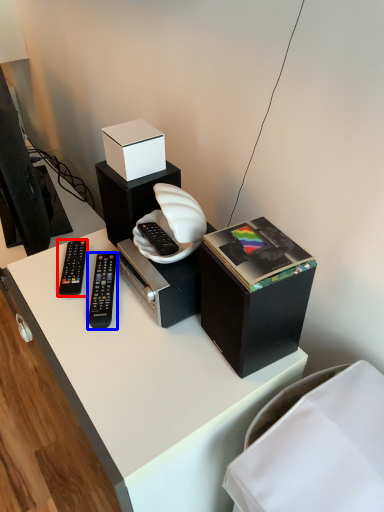
Question: Which object appears closest to the camera in this image, remote control (highlighted by a red box) or remote control (highlighted by a blue box)?

Choices:
 (A) remote control
 (B) remote control

Answer: (B)